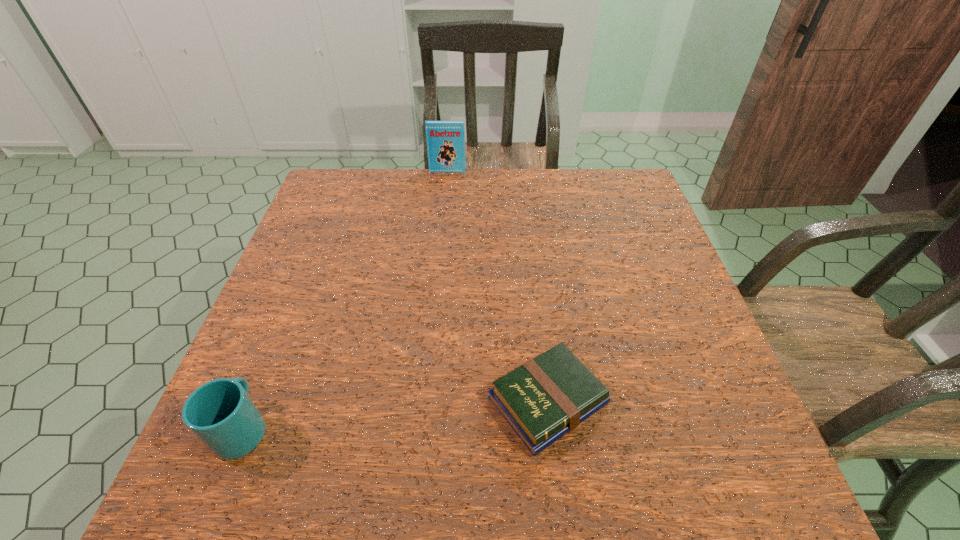
Locate an element on the screen. This screenshot has width=960, height=540. free space between the shorter book and the cup is located at coordinates (396, 414).

Choose which object is the second nearest neighbor to the shorter book. Please provide its 2D coordinates. Your answer should be formatted as a tuple, i.e. [(x, y)], where the tuple contains the x and y coordinates of a point satisfying the conditions above.

[(445, 140)]

Identify which object is the nearest to the cup. Please provide its 2D coordinates. Your answer should be formatted as a tuple, i.e. [(x, y)], where the tuple contains the x and y coordinates of a point satisfying the conditions above.

[(547, 397)]

Locate an element on the screen. The height and width of the screenshot is (540, 960). vacant region that satisfies the following two spatial constraints: 1. on the front cover of the shortest object; 2. on the right side of the left book is located at coordinates (425, 401).

In order to click on free space that satisfies the following two spatial constraints: 1. on the front cover of the nearer book; 2. on the left side of the farther book in this screenshot , I will do `click(425, 401)`.

Image resolution: width=960 pixels, height=540 pixels. I want to click on vacant space that satisfies the following two spatial constraints: 1. on the handle side of the cup; 2. on the left side of the right book, so click(253, 401).

Image resolution: width=960 pixels, height=540 pixels. Find the location of `free location that satisfies the following two spatial constraints: 1. on the front cover of the rightmost object; 2. on the left side of the farthest object`. free location that satisfies the following two spatial constraints: 1. on the front cover of the rightmost object; 2. on the left side of the farthest object is located at coordinates (425, 401).

Find the location of a particular element. Image resolution: width=960 pixels, height=540 pixels. vacant position in the image that satisfies the following two spatial constraints: 1. on the front cover of the rightmost object; 2. on the left side of the tallest object is located at coordinates (425, 401).